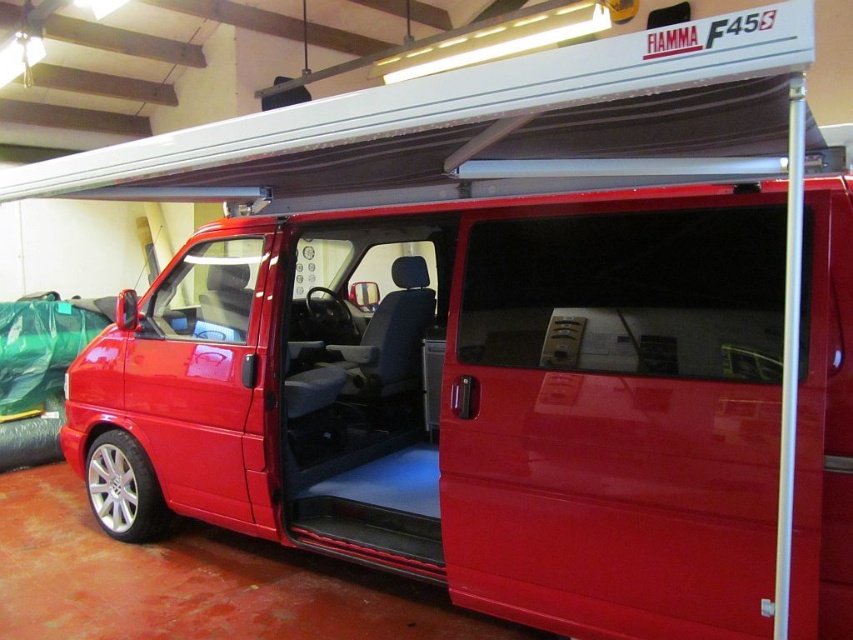
Does glossy red van at center have a larger size compared to glossy plastic door at center?

Correct, glossy red van at center is larger in size than glossy plastic door at center.

How much distance is there between glossy red van at center and glossy plastic door at center?

glossy red van at center is 27.58 centimeters away from glossy plastic door at center.

This screenshot has width=853, height=640. I want to click on glossy red van at center, so click(469, 400).

Find the location of a particular element. This screenshot has width=853, height=640. glossy red van at center is located at coordinates (469, 400).